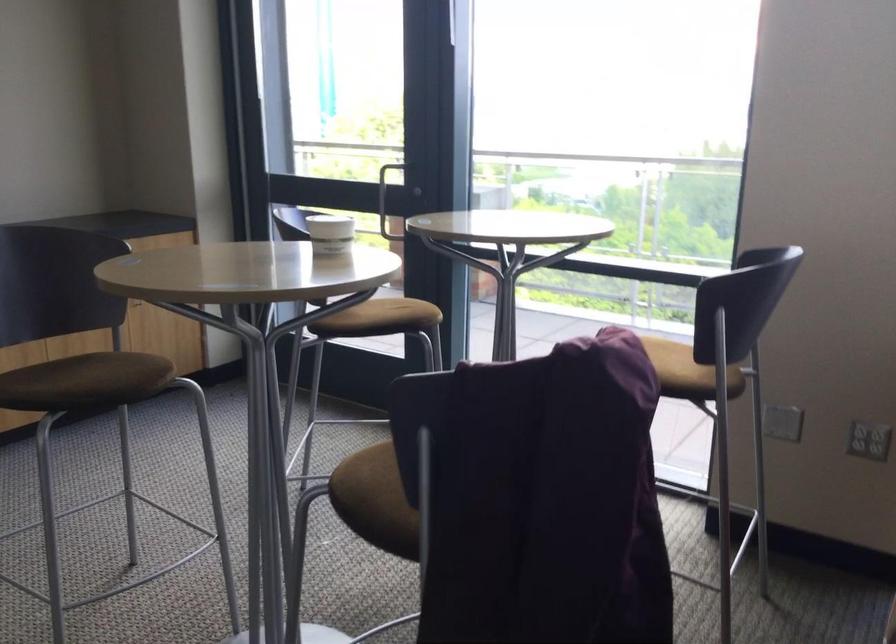
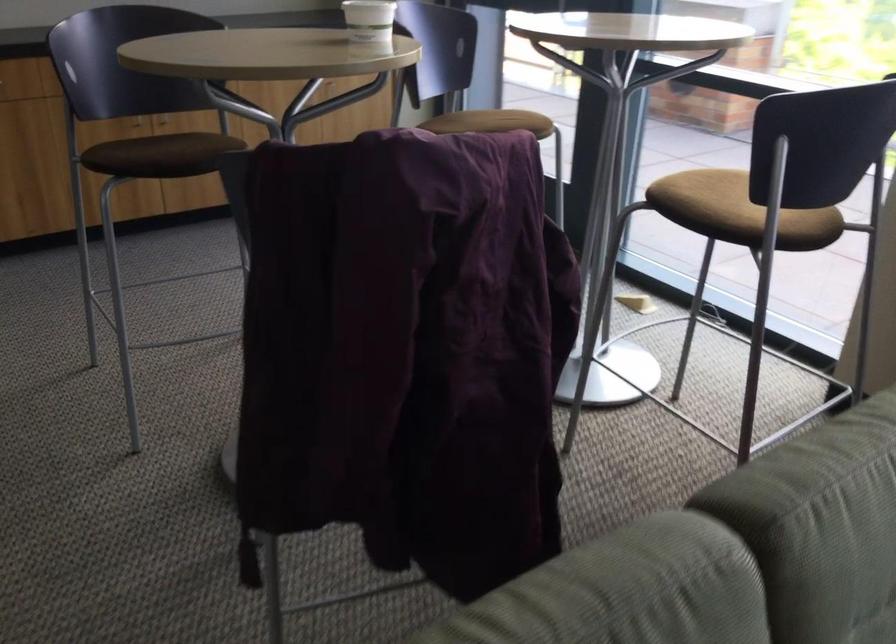
Question: Which direction would the cameraman need to move to produce the second image? Reply with the corresponding letter.

Choices:
 (A) Left
 (B) Right
 (C) Forward
 (D) Backward

Answer: (B)